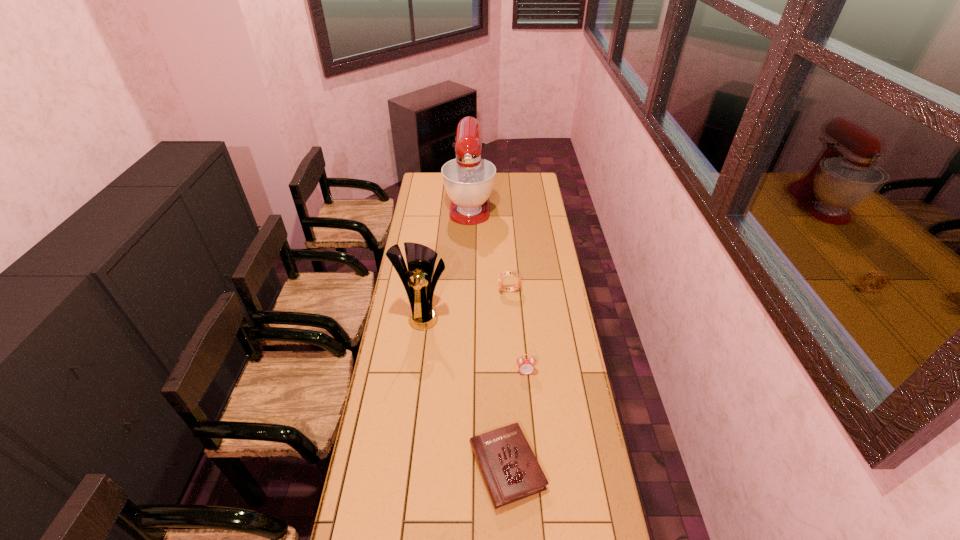
Image resolution: width=960 pixels, height=540 pixels. What are the coordinates of `free spot between the alarm clock and the shortest object` in the screenshot? It's located at (516, 419).

Where is `vacant point located between the tallest object and the third nearest object`? vacant point located between the tallest object and the third nearest object is located at coordinates (446, 260).

Locate an element on the screen. free spot between the award and the fourth nearest object is located at coordinates (467, 303).

At what (x,y) coordinates should I click in order to perform the action: click on vacant area between the nearest object and the tallest object. Please return your answer as a coordinate pair (x, y). Looking at the image, I should click on (489, 336).

Identify the location of free space between the shortest object and the fourth nearest object. Image resolution: width=960 pixels, height=540 pixels. (508, 379).

Where is `vacant area that lies between the tallest object and the second farthest object`? The height and width of the screenshot is (540, 960). vacant area that lies between the tallest object and the second farthest object is located at coordinates (490, 247).

Where is `empty space between the fourth nearest object and the shortest object`? This screenshot has height=540, width=960. empty space between the fourth nearest object and the shortest object is located at coordinates (508, 379).

Find the location of a particular element. Image resolution: width=960 pixels, height=540 pixels. vacant space that's between the second nearest object and the hardback book is located at coordinates (516, 419).

Where is `free point between the fourth farthest object and the nearest object`? This screenshot has height=540, width=960. free point between the fourth farthest object and the nearest object is located at coordinates (516, 419).

Locate an element on the screen. The height and width of the screenshot is (540, 960). empty space between the second farthest object and the hardback book is located at coordinates click(508, 379).